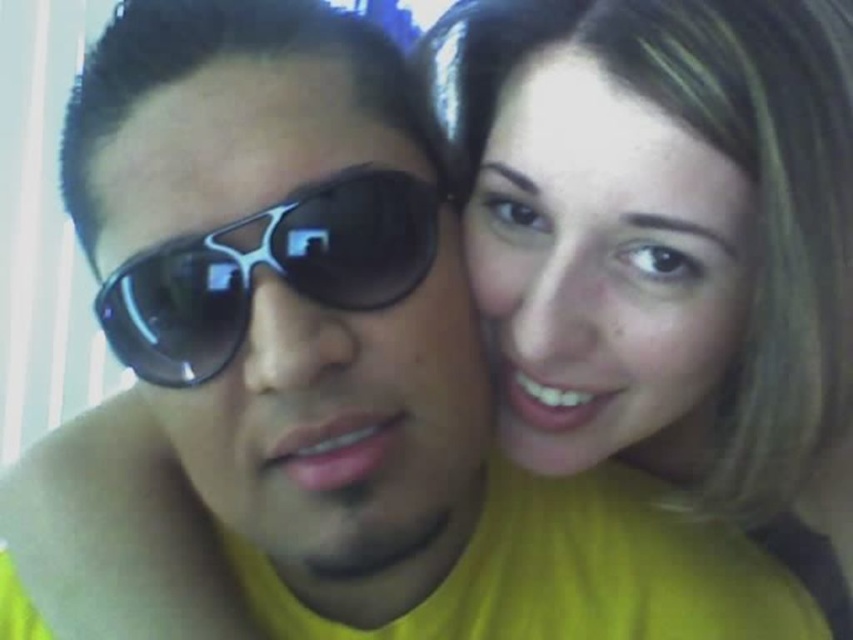
Is matte yellow shirt at upper right to the right of black plastic sunglasses at left from the viewer's perspective?

Indeed, matte yellow shirt at upper right is positioned on the right side of black plastic sunglasses at left.

Who is higher up, matte yellow shirt at upper right or black plastic sunglasses at left?

black plastic sunglasses at left is above.

Find the location of `matte yellow shirt at upper right`. matte yellow shirt at upper right is located at coordinates (663, 241).